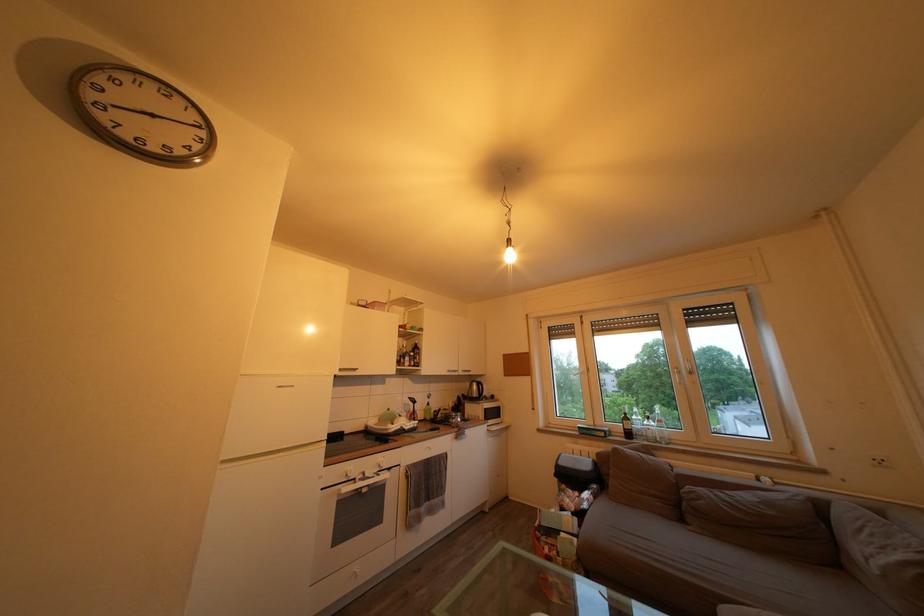
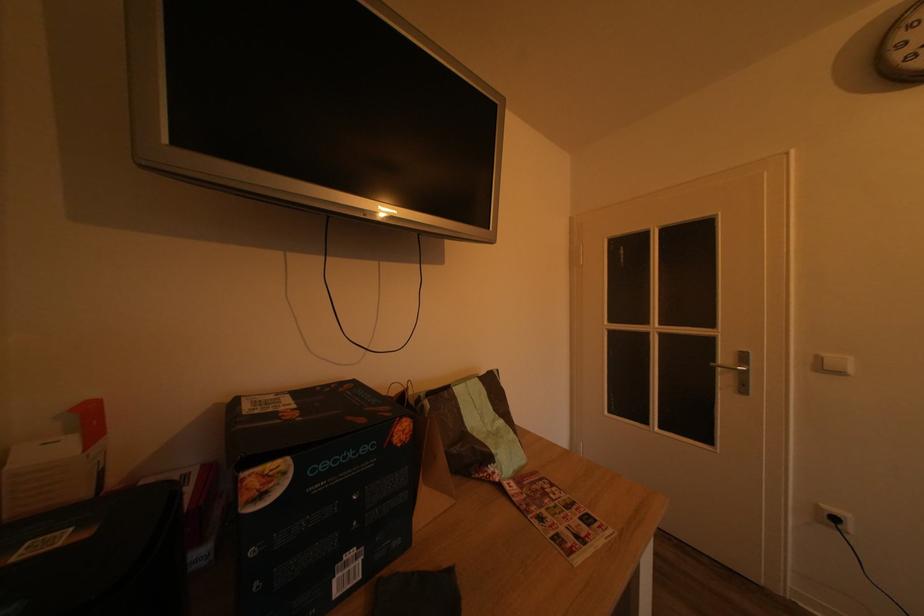
Question: The first image is from the beginning of the video and the second image is from the end. How did the camera likely rotate when shooting the video?

Choices:
 (A) Left
 (B) Right
 (C) Up
 (D) Down

Answer: (A)